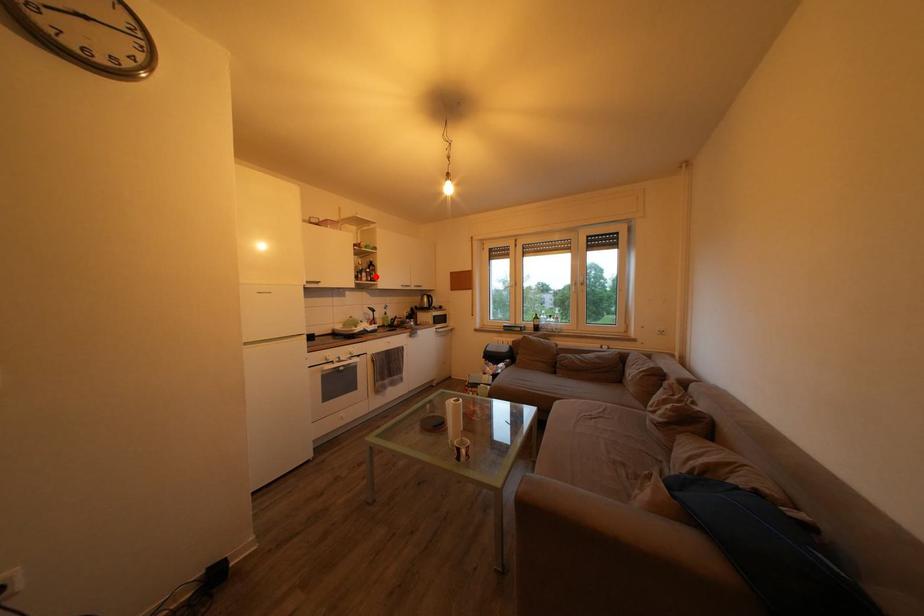
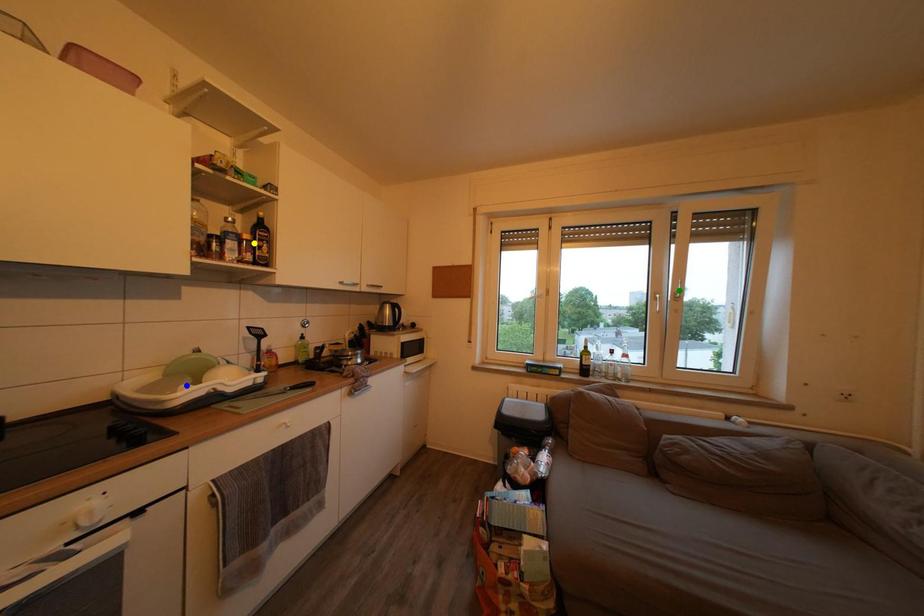
Question: I am providing you with two images of the same scene from different viewpoints. A red point is marked on the first image. You are given multiple points on the second image. Which mark in image 2 goes with the point in image 1?

Choices:
 (A) yellow point
 (B) green point
 (C) blue point

Answer: (A)